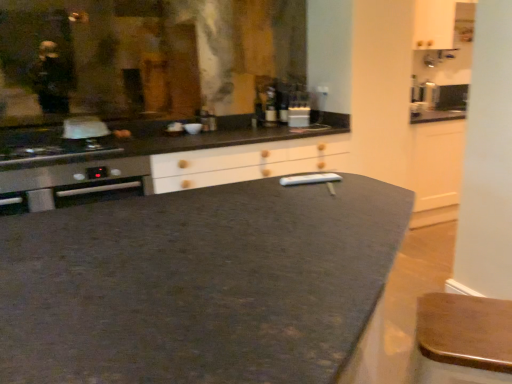
Question: In which direction should I rotate to look at matte glass bottle at center, the 2th bottle positioned from the left?

Choices:
 (A) left
 (B) right

Answer: (B)

Question: Which direction should I rotate to face matte glass bottle at center, the first bottle when ordered from left to right, — up or down?

Choices:
 (A) up
 (B) down

Answer: (A)

Question: Is wooden bar stool at lower right bigger than stainless steel oven at left?

Choices:
 (A) yes
 (B) no

Answer: (A)

Question: Is wooden bar stool at lower right thinner than stainless steel oven at left?

Choices:
 (A) no
 (B) yes

Answer: (B)

Question: Is the position of wooden bar stool at lower right more distant than that of stainless steel oven at left?

Choices:
 (A) yes
 (B) no

Answer: (B)

Question: Considering the relative sizes of wooden bar stool at lower right and stainless steel oven at left in the image provided, is wooden bar stool at lower right wider than stainless steel oven at left?

Choices:
 (A) no
 (B) yes

Answer: (A)

Question: Is wooden bar stool at lower right oriented away from stainless steel oven at left?

Choices:
 (A) no
 (B) yes

Answer: (A)

Question: From the image's perspective, is wooden bar stool at lower right above stainless steel oven at left?

Choices:
 (A) no
 (B) yes

Answer: (A)

Question: From a real-world perspective, does matte glass bottle at center, placed as the first bottle when sorted from right to left, sit lower than matte glass bottle at center, the first bottle when ordered from left to right?

Choices:
 (A) yes
 (B) no

Answer: (B)

Question: From the image's perspective, is matte glass bottle at center, placed as the first bottle when sorted from right to left, below matte glass bottle at center, the first bottle when ordered from left to right?

Choices:
 (A) no
 (B) yes

Answer: (A)

Question: Is matte glass bottle at center, the 2th bottle positioned from the left, surrounding matte glass bottle at center, marked as the second bottle in a right-to-left arrangement?

Choices:
 (A) yes
 (B) no

Answer: (B)

Question: Is matte glass bottle at center, the 2th bottle positioned from the left, at the right side of matte glass bottle at center, the first bottle when ordered from left to right?

Choices:
 (A) yes
 (B) no

Answer: (A)

Question: Can you confirm if matte glass bottle at center, placed as the first bottle when sorted from right to left, is wider than matte glass bottle at center, the first bottle when ordered from left to right?

Choices:
 (A) yes
 (B) no

Answer: (B)

Question: Considering the relative sizes of matte glass bottle at center, placed as the first bottle when sorted from right to left, and matte glass bottle at center, marked as the second bottle in a right-to-left arrangement, in the image provided, is matte glass bottle at center, placed as the first bottle when sorted from right to left, taller than matte glass bottle at center, marked as the second bottle in a right-to-left arrangement,?

Choices:
 (A) no
 (B) yes

Answer: (B)

Question: From the image's perspective, does matte glass bottle at center, placed as the first bottle when sorted from right to left, appear higher than wooden bar stool at lower right?

Choices:
 (A) yes
 (B) no

Answer: (A)